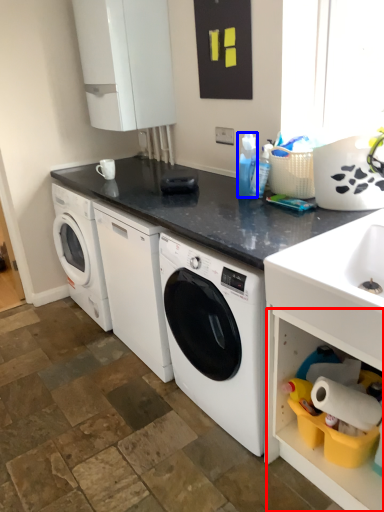
Question: Which point is further to the camera, shelf (highlighted by a red box) or cleaning product (highlighted by a blue box)?

Choices:
 (A) shelf
 (B) cleaning product

Answer: (B)